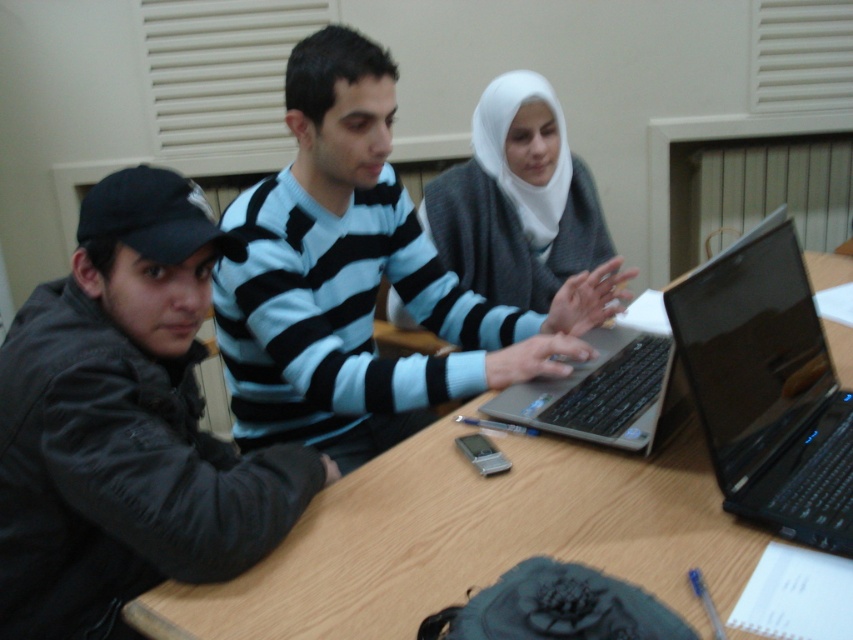
You are a photographer trying to capture a clear shot of the black glossy laptop at right and the white matte hijab at center. Since you want to focus on the laptop, which object should you adjust your camera settings to prioritize in terms of size in the frame?

The black glossy laptop at right is smaller in size compared to the white matte hijab at center. Therefore, to prioritize the laptop in the frame, you should adjust your camera settings to focus on the smaller object.

You are a photographer trying to capture a clear shot of the black glossy laptop at center without any obstruction. The light blue striped sweater at center is in the way. Can you estimate if the sweater is wider than the laptop? If so, how much of the laptop can you see?

The light blue striped sweater at center might be wider than black glossy laptop at center, so it is possible that the sweater is blocking most of the laptop. However, without exact measurements, it is uncertain how much of the laptop is visible.